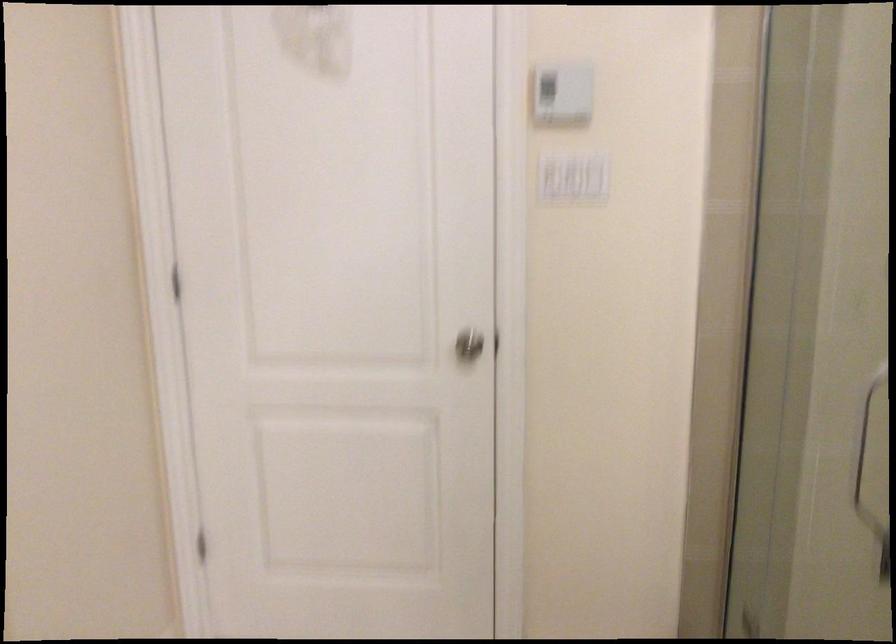
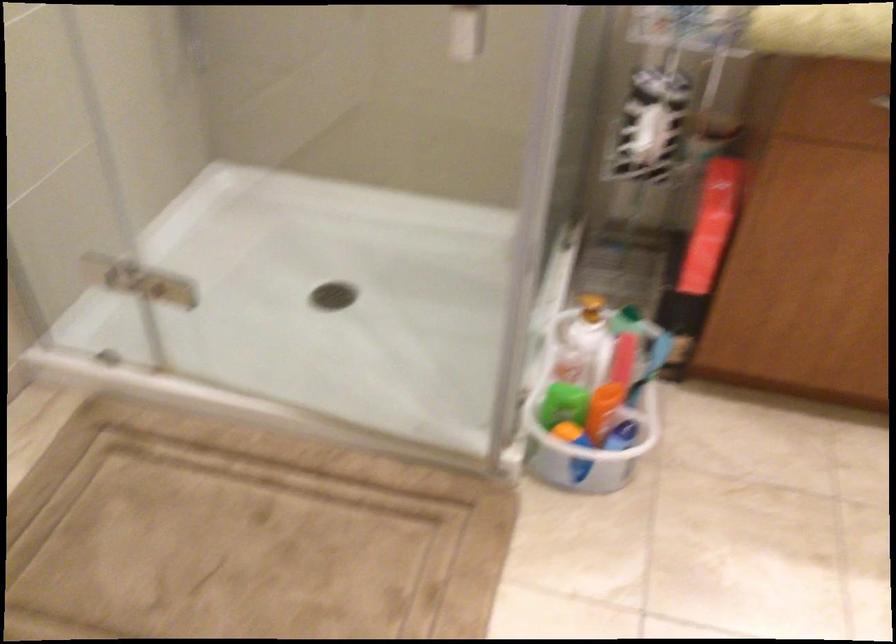
The images are taken continuously from a first-person perspective. In which direction is your viewpoint rotating?

The camera's rotation is toward right-down.